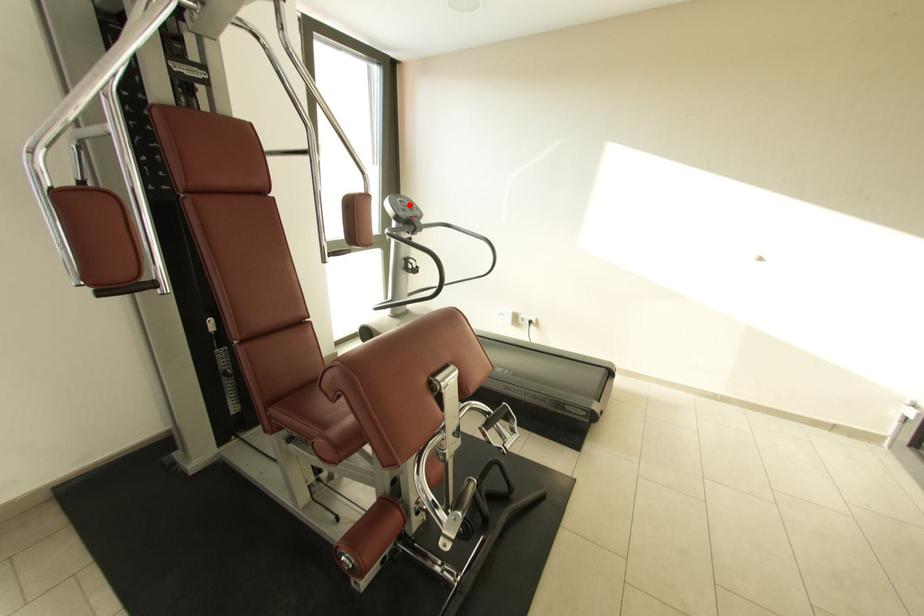
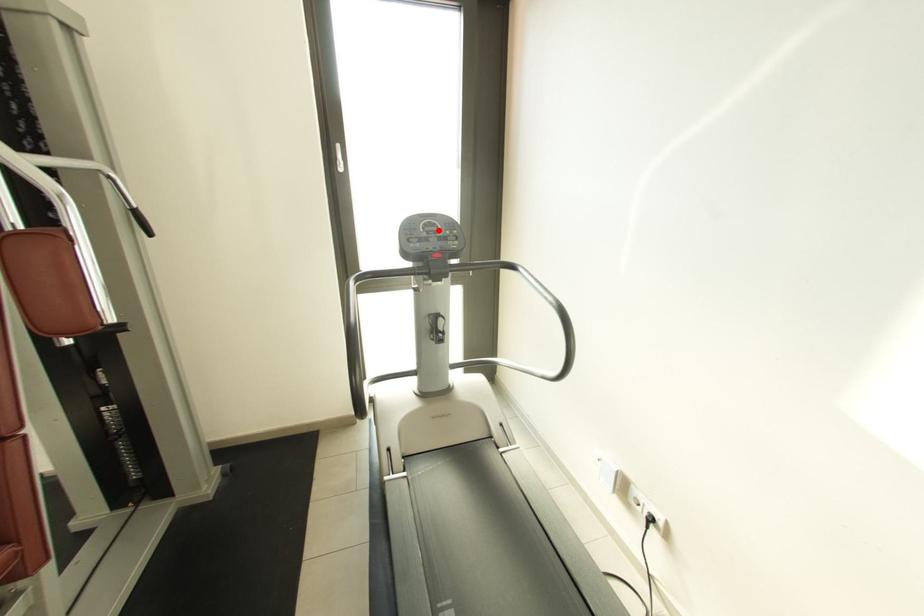
I am providing you with two images of the same scene from different viewpoints. A red point is marked on the first image and another point is marked on the second image. Do the highlighted points in image1 and image2 indicate the same real-world spot?

Yes